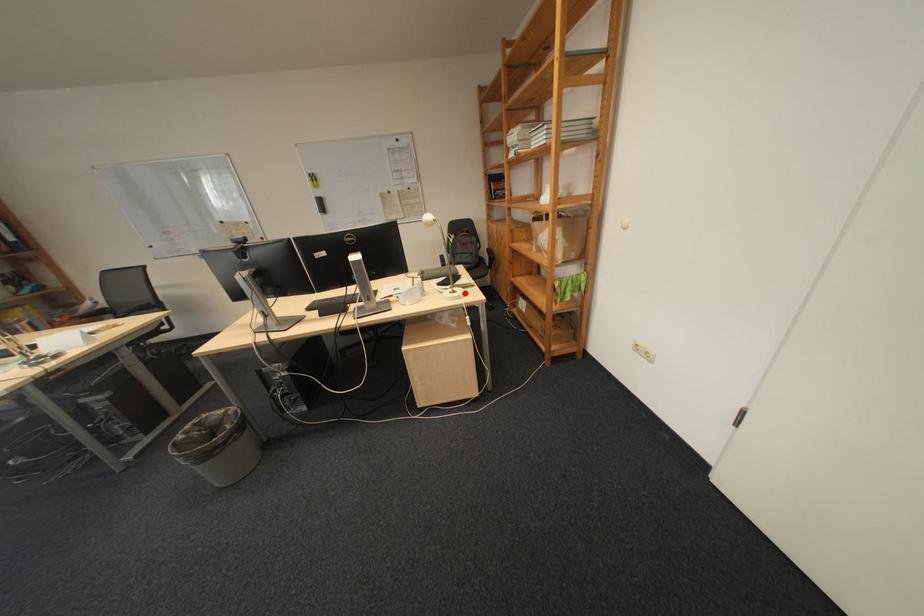
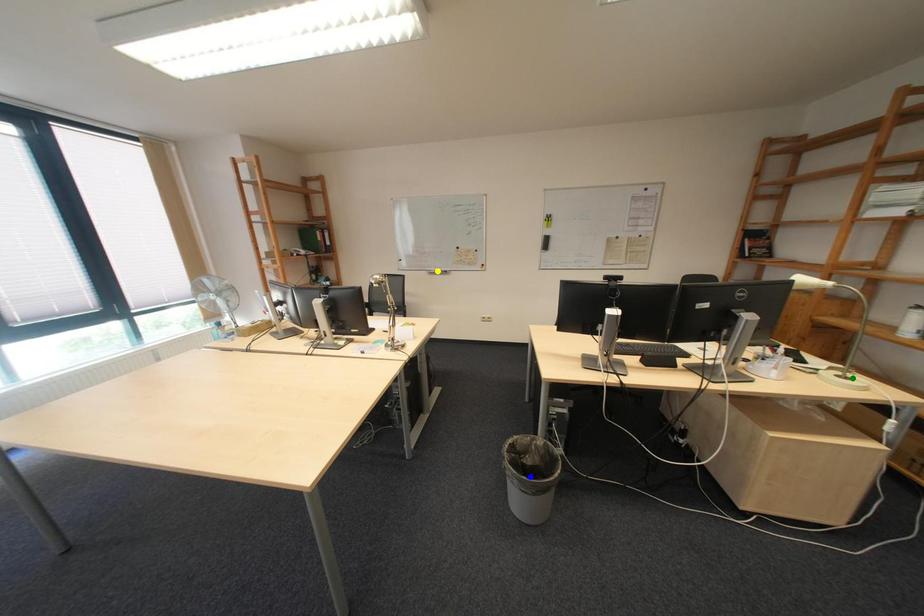
Question: I am providing you with two images of the same scene from different viewpoints. A red point is marked on the first image. You are given multiple points on the second image. Which mark in image 2 goes with the point in image 1?

Choices:
 (A) green point
 (B) blue point
 (C) yellow point

Answer: (A)